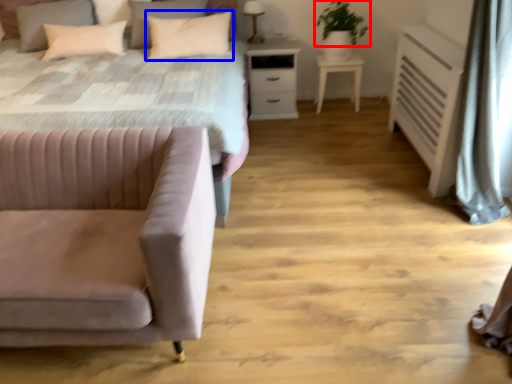
Question: Which object is closer to the camera taking this photo, plant (highlighted by a red box) or pillow (highlighted by a blue box)?

Choices:
 (A) plant
 (B) pillow

Answer: (B)